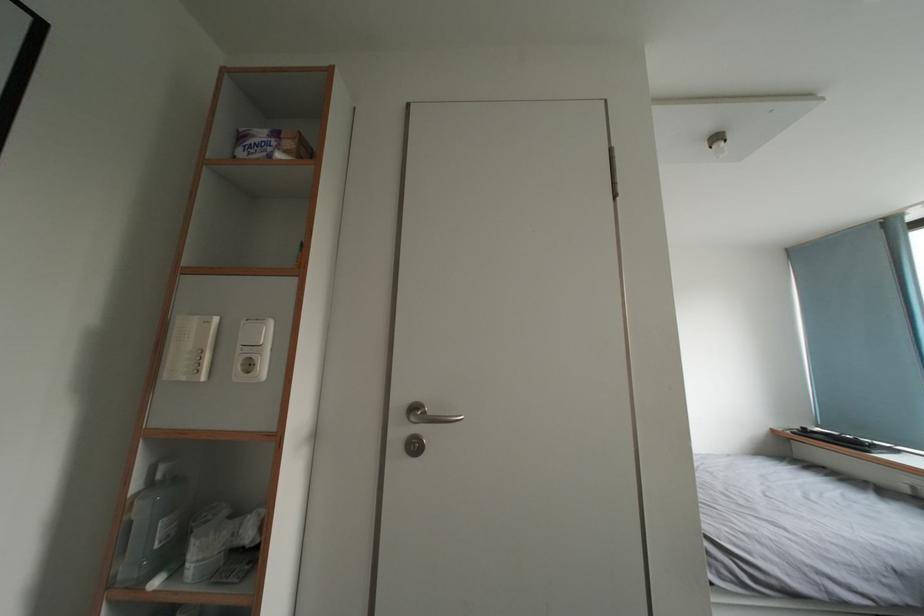
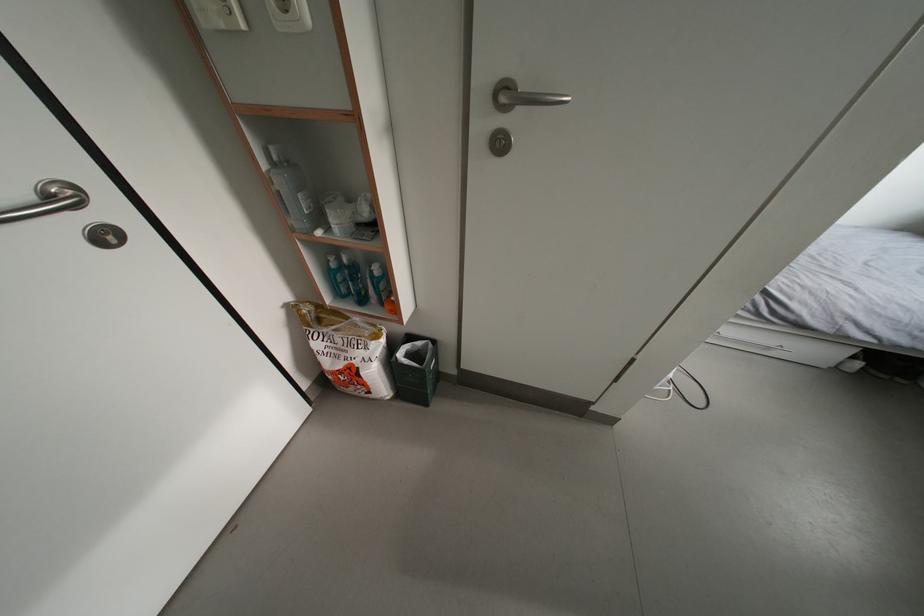
In the second image, find the point that corresponds to point (165, 482) in the first image.

(283, 163)